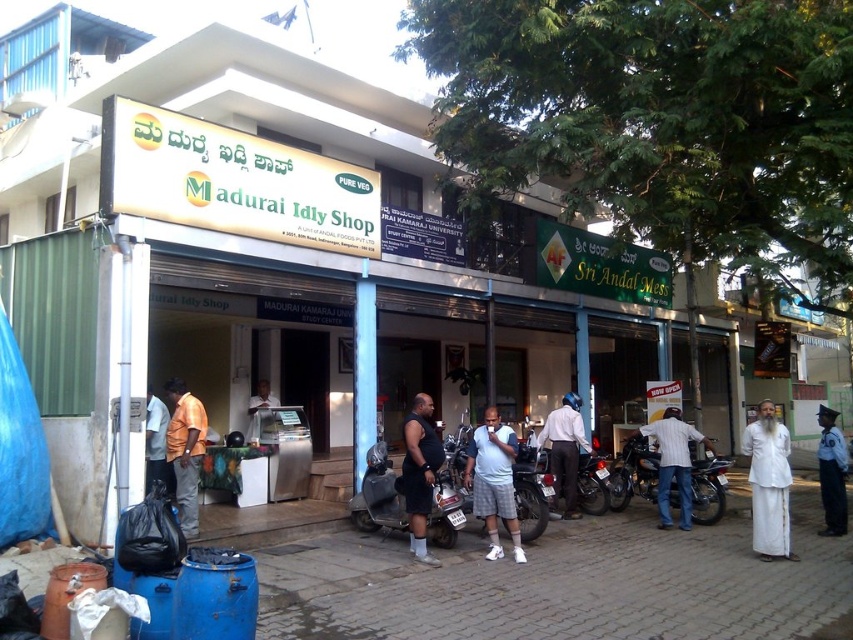
Is dark blue tank top at center smaller than metallic silver refrigerator at center?

No.

Can you confirm if dark blue tank top at center is positioned above metallic silver refrigerator at center?

No.

The width and height of the screenshot is (853, 640). Identify the location of dark blue tank top at center. (419, 474).

Where is `dark blue tank top at center`? Image resolution: width=853 pixels, height=640 pixels. dark blue tank top at center is located at coordinates (419, 474).

Between matte blue shirt at center and metallic silver motorcycle at center, which one is positioned higher?

matte blue shirt at center

Can you confirm if matte blue shirt at center is positioned to the right of metallic silver motorcycle at center?

No, matte blue shirt at center is not to the right of metallic silver motorcycle at center.

Where is `matte blue shirt at center`? The width and height of the screenshot is (853, 640). matte blue shirt at center is located at coordinates (492, 481).

Between white shirt at center and orange shirt at left, which one has more height?

white shirt at center

Can you confirm if white shirt at center is thinner than orange shirt at left?

No.

Image resolution: width=853 pixels, height=640 pixels. What do you see at coordinates (566, 449) in the screenshot?
I see `white shirt at center` at bounding box center [566, 449].

Where is `white shirt at center`? The image size is (853, 640). white shirt at center is located at coordinates (566, 449).